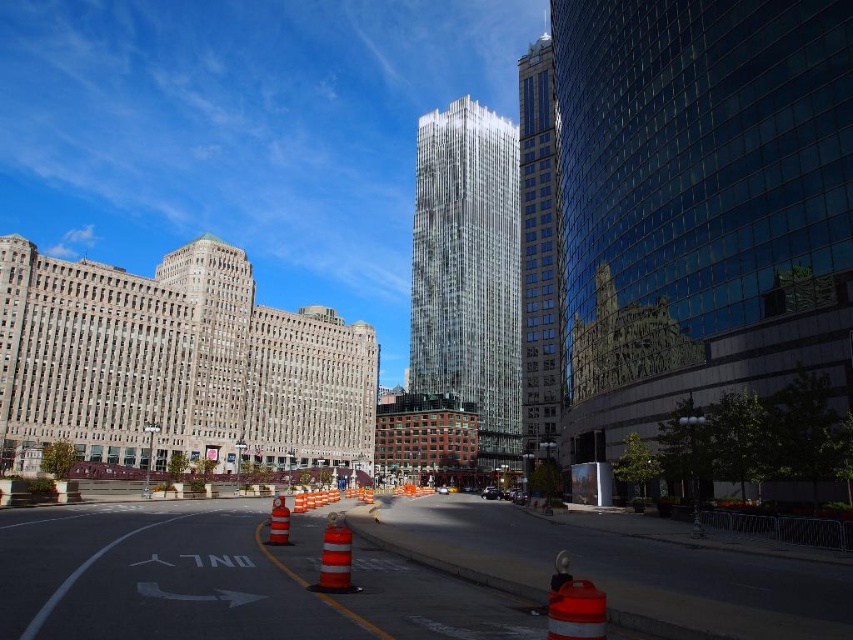
Between clear glass skyscraper at center and shiny glass skyscraper at center, which one has more height?

shiny glass skyscraper at center is taller.

The width and height of the screenshot is (853, 640). I want to click on clear glass skyscraper at center, so click(468, 273).

Locate an element on the screen. clear glass skyscraper at center is located at coordinates (468, 273).

Looking at this image, how much distance is there between clear glass skyscraper at center and reflective orange traffic cone at center?

They are 269.93 feet apart.

Between clear glass skyscraper at center and reflective orange traffic cone at center, which one appears on the right side from the viewer's perspective?

clear glass skyscraper at center

Does point (473, 202) lie behind point (277, 528)?

Yes, it is behind point (277, 528).

Image resolution: width=853 pixels, height=640 pixels. In order to click on clear glass skyscraper at center in this screenshot , I will do `click(468, 273)`.

Between orange reflective cone at center and reflective orange traffic cone at center, which one has less height?

Standing shorter between the two is reflective orange traffic cone at center.

Is point (349, 589) less distant than point (271, 522)?

Yes, point (349, 589) is in front of point (271, 522).

What do you see at coordinates (335, 556) in the screenshot? The width and height of the screenshot is (853, 640). I see `orange reflective cone at center` at bounding box center [335, 556].

The image size is (853, 640). In order to click on orange reflective cone at center in this screenshot , I will do `click(335, 556)`.